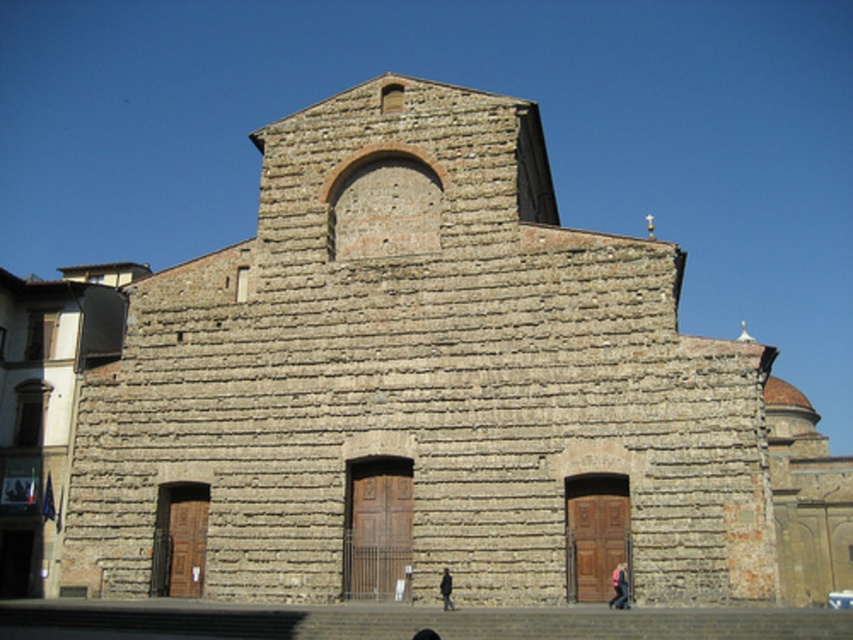
Is point (439, 582) in front of point (415, 634)?

That is False.

Is dark gray jacket at center bigger than dark brown leather shoe at lower center?

Yes.

Is point (447, 582) more distant than point (428, 627)?

That is True.

Locate an element on the screen. The height and width of the screenshot is (640, 853). dark gray jacket at center is located at coordinates (445, 589).

Where is `pink fabric at lower right`? pink fabric at lower right is located at coordinates (619, 586).

In the scene shown: Is pink fabric at lower right closer to camera compared to dark gray jacket at center?

Yes, pink fabric at lower right is closer to the viewer.

This screenshot has height=640, width=853. I want to click on pink fabric at lower right, so click(619, 586).

Which is below, pink fabric at lower right or dark brown leather shoe at lower center?

Positioned lower is dark brown leather shoe at lower center.

Which is above, pink fabric at lower right or dark brown leather shoe at lower center?

pink fabric at lower right is above.

I want to click on pink fabric at lower right, so click(x=619, y=586).